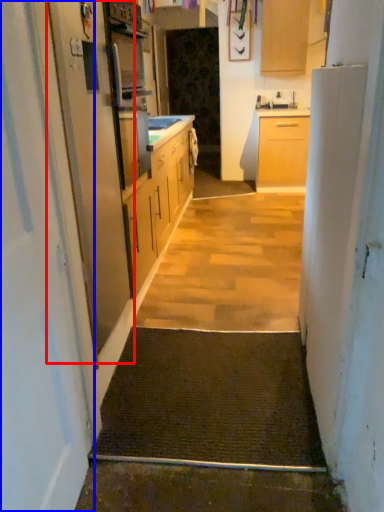
Question: Which of the following is the closest to the observer, screen door (highlighted by a red box) or door (highlighted by a blue box)?

Choices:
 (A) screen door
 (B) door

Answer: (B)